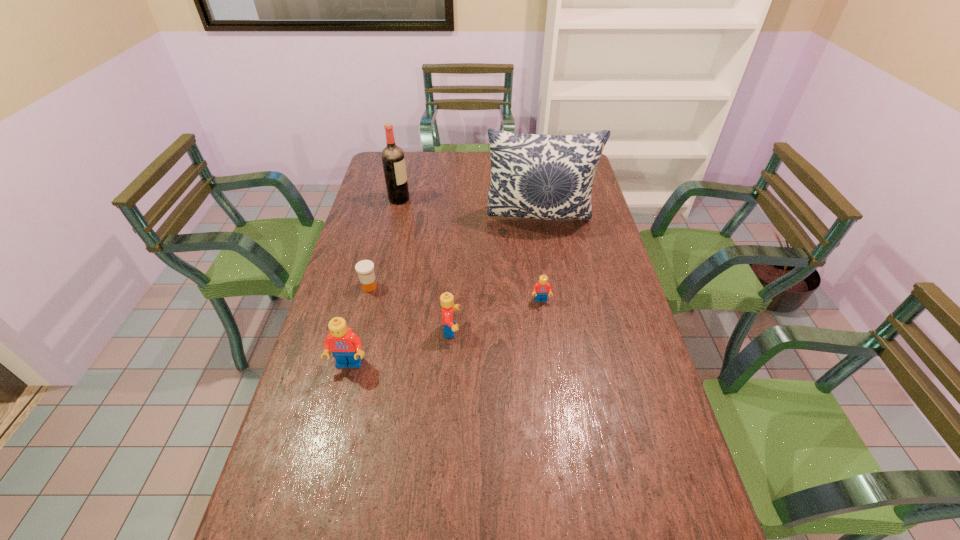
What are the coordinates of `vacant space in between the shortest Lego and the cushion` in the screenshot? It's located at (540, 259).

Identify which object is the third nearest to the cushion. Please provide its 2D coordinates. Your answer should be formatted as a tuple, i.e. [(x, y)], where the tuple contains the x and y coordinates of a point satisfying the conditions above.

[(446, 299)]

Where is `object that is the second closest to the cushion`? object that is the second closest to the cushion is located at coordinates (393, 159).

Select which Lego is the closest to the leftmost Lego. Please provide its 2D coordinates. Your answer should be formatted as a tuple, i.e. [(x, y)], where the tuple contains the x and y coordinates of a point satisfying the conditions above.

[(446, 299)]

Select which Lego is the closest to the second Lego from left to right. Please provide its 2D coordinates. Your answer should be formatted as a tuple, i.e. [(x, y)], where the tuple contains the x and y coordinates of a point satisfying the conditions above.

[(346, 346)]

The width and height of the screenshot is (960, 540). What are the coordinates of `free spot that satisfies the following two spatial constraints: 1. on the front surface of the cushion; 2. on the face of the fifth farthest object` in the screenshot? It's located at (558, 330).